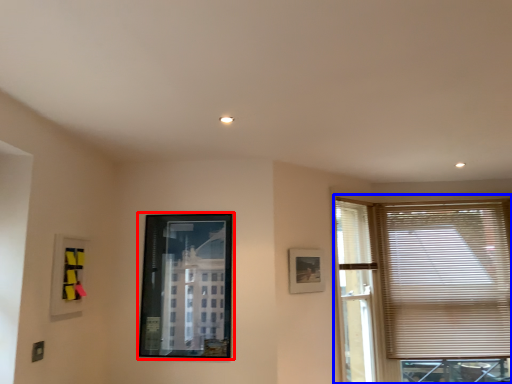
Question: Which object is further to the camera taking this photo, picture frame (highlighted by a red box) or window (highlighted by a blue box)?

Choices:
 (A) picture frame
 (B) window

Answer: (B)